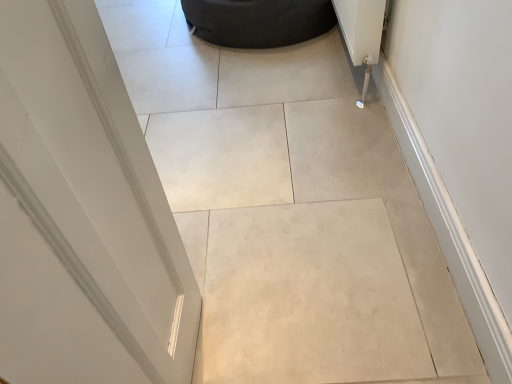
At what (x,y) coordinates should I click in order to perform the action: click on dark gray fabric bean bag at upper center. Please return your answer as a coordinate pair (x, y). The height and width of the screenshot is (384, 512). Looking at the image, I should click on (258, 21).

Measure the distance between dark gray fabric bean bag at upper center and camera.

dark gray fabric bean bag at upper center is 2.07 meters from camera.

The height and width of the screenshot is (384, 512). Describe the element at coordinates (258, 21) in the screenshot. I see `dark gray fabric bean bag at upper center` at that location.

You are a GUI agent. You are given a task and a screenshot of the screen. Output one action in this format:
    pyautogui.click(x=<x>, y=<y>)
    Task: Click on the dark gray fabric bean bag at upper center
    The image size is (512, 384).
    Given the screenshot: What is the action you would take?
    pyautogui.click(x=258, y=21)